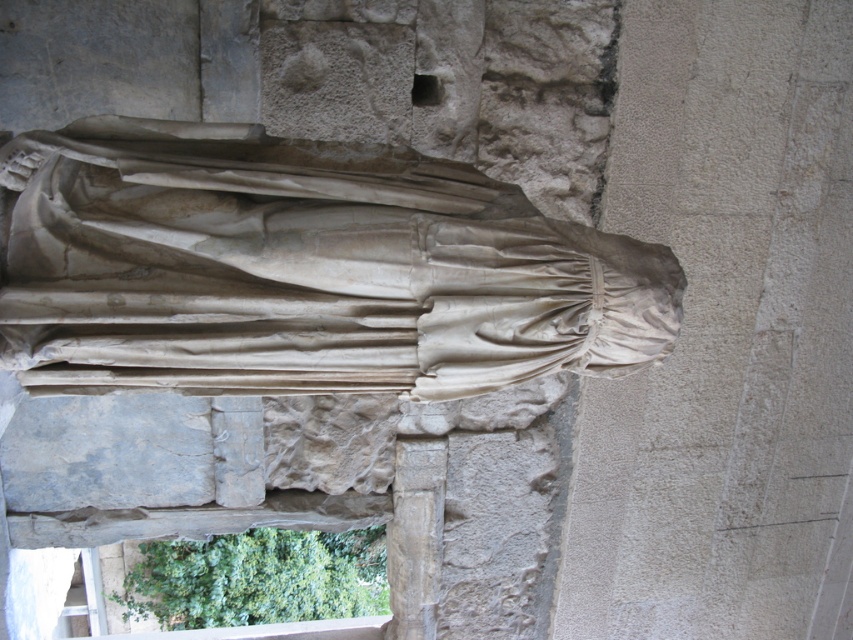
Question: Which point appears farthest from the camera in this image?

Choices:
 (A) (491, 211)
 (B) (392, 550)

Answer: (B)

Question: Is white marble statue at center closer to the viewer compared to smooth stone column at center?

Choices:
 (A) yes
 (B) no

Answer: (A)

Question: Is white marble statue at center further to camera compared to smooth stone column at center?

Choices:
 (A) no
 (B) yes

Answer: (A)

Question: Among these objects, which one is nearest to the camera?

Choices:
 (A) white marble statue at center
 (B) smooth stone column at center

Answer: (A)

Question: Which of the following is the farthest from the observer?

Choices:
 (A) (392, 266)
 (B) (386, 632)

Answer: (B)

Question: Is white marble statue at center wider than smooth stone column at center?

Choices:
 (A) yes
 (B) no

Answer: (A)